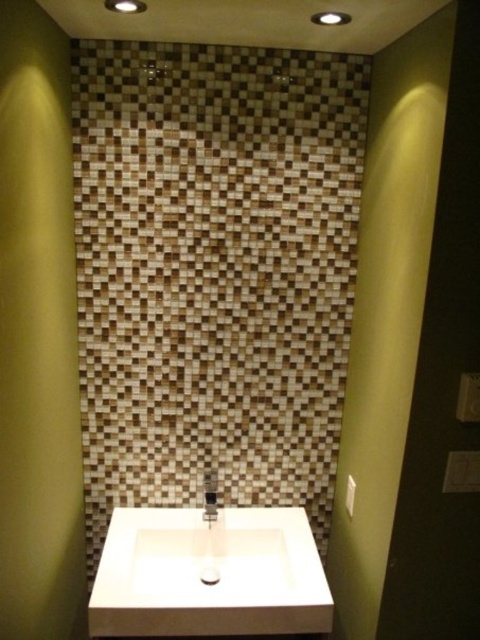
Who is more distant from viewer, (103, 240) or (210, 480)?

Positioned behind is point (210, 480).

Does brown mosaic tile at center lie in front of satin nickel faucet at center?

Yes, it is in front of satin nickel faucet at center.

Consider the image. Who is more forward, [322,556] or [211,474]?

Point [211,474] is more forward.

Locate an element on the screen. The image size is (480, 640). brown mosaic tile at center is located at coordinates (214, 272).

Can you confirm if brown mosaic tile at center is positioned below white matte sink at center?

Answer: Incorrect, brown mosaic tile at center is not positioned below white matte sink at center.

Does brown mosaic tile at center have a smaller size compared to white matte sink at center?

No.

You are a GUI agent. You are given a task and a screenshot of the screen. Output one action in this format:
    pyautogui.click(x=<x>, y=<y>)
    Task: Click on the brown mosaic tile at center
    
    Given the screenshot: What is the action you would take?
    pyautogui.click(x=214, y=272)

Does white matte sink at center have a smaller size compared to satin nickel faucet at center?

No.

Can you confirm if white matte sink at center is shorter than satin nickel faucet at center?

No.

Describe the element at coordinates (201, 573) in the screenshot. I see `white matte sink at center` at that location.

Locate an element on the screen. The image size is (480, 640). white matte sink at center is located at coordinates (201, 573).